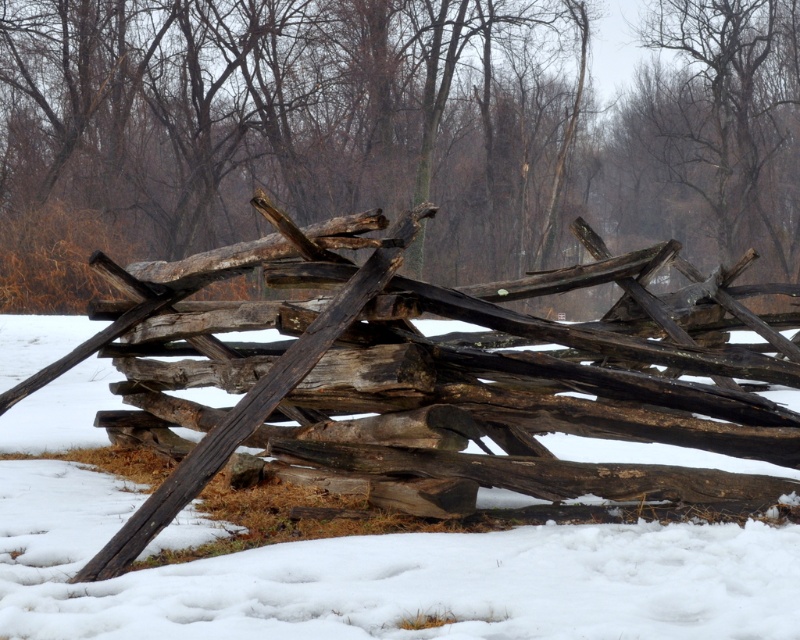
Question: Which of the following is the closest to the observer?

Choices:
 (A) (770, 10)
 (B) (48, 410)

Answer: (B)

Question: Which object appears closest to the camera in this image?

Choices:
 (A) brown textured wood at upper center
 (B) weathered wood fence at center

Answer: (B)

Question: Observing the image, what is the correct spatial positioning of weathered wood fence at center in reference to brown textured wood at upper center?

Choices:
 (A) left
 (B) right

Answer: (A)

Question: Is weathered wood fence at center bigger than white powdery snow at center?

Choices:
 (A) yes
 (B) no

Answer: (A)

Question: Is weathered wood fence at center positioned at the back of brown textured wood at upper center?

Choices:
 (A) yes
 (B) no

Answer: (B)

Question: Among these objects, which one is nearest to the camera?

Choices:
 (A) weathered wood fence at center
 (B) brown textured wood at upper center

Answer: (A)